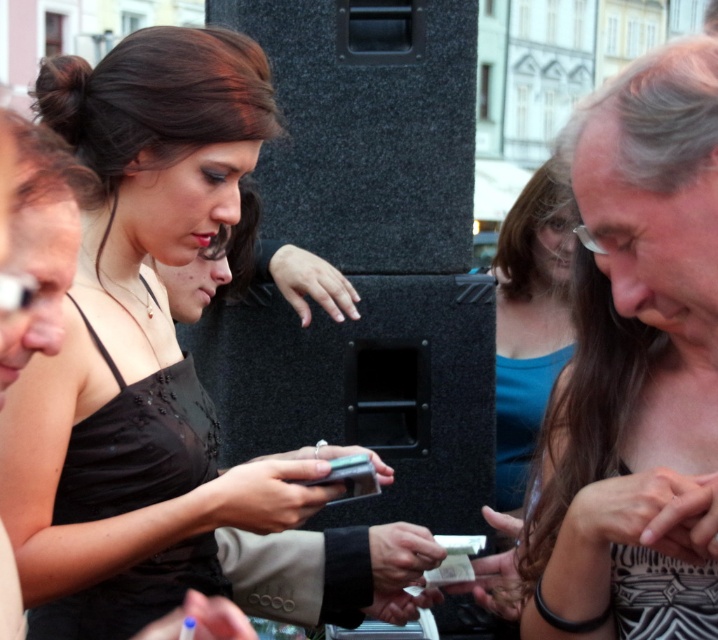
From the picture: Does gray textured hair at center appear on the left side of blue fabric shirt at center?

No, gray textured hair at center is not to the left of blue fabric shirt at center.

Does gray textured hair at center have a lesser width compared to blue fabric shirt at center?

Correct, gray textured hair at center's width is less than blue fabric shirt at center's.

Is point (691, 141) farther from viewer compared to point (536, 214)?

No, it is not.

Where is `gray textured hair at center`? gray textured hair at center is located at coordinates (635, 369).

Does blue fabric shirt at center appear on the right side of black glossy smartphone at center?

Correct, you'll find blue fabric shirt at center to the right of black glossy smartphone at center.

Is blue fabric shirt at center to the left of black glossy smartphone at center from the viewer's perspective?

In fact, blue fabric shirt at center is to the right of black glossy smartphone at center.

Describe the element at coordinates (528, 324) in the screenshot. This screenshot has height=640, width=718. I see `blue fabric shirt at center` at that location.

You are a GUI agent. You are given a task and a screenshot of the screen. Output one action in this format:
    pyautogui.click(x=<x>, y=<y>)
    Task: Click on the blue fabric shirt at center
    This screenshot has height=640, width=718.
    Given the screenshot: What is the action you would take?
    pyautogui.click(x=528, y=324)

Does matte black dress at center have a lesser height compared to blue fabric shirt at center?

Incorrect, matte black dress at center's height does not fall short of blue fabric shirt at center's.

Who is more distant from viewer, (x=197, y=192) or (x=513, y=292)?

The point (x=513, y=292) is behind.

What do you see at coordinates (167, 378) in the screenshot?
I see `matte black dress at center` at bounding box center [167, 378].

This screenshot has width=718, height=640. In order to click on matte black dress at center in this screenshot , I will do `click(167, 378)`.